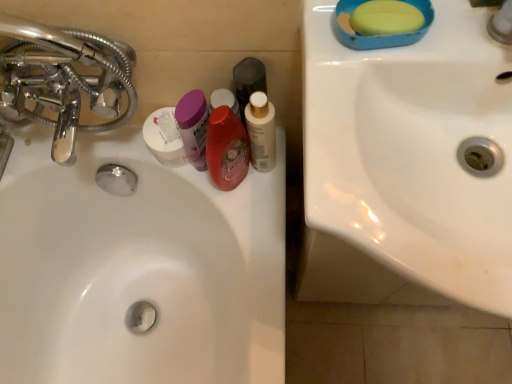
The width and height of the screenshot is (512, 384). In order to click on free space in front of translucent purple mouthwash at center, the third mouthwash from the right in this screenshot , I will do `click(253, 246)`.